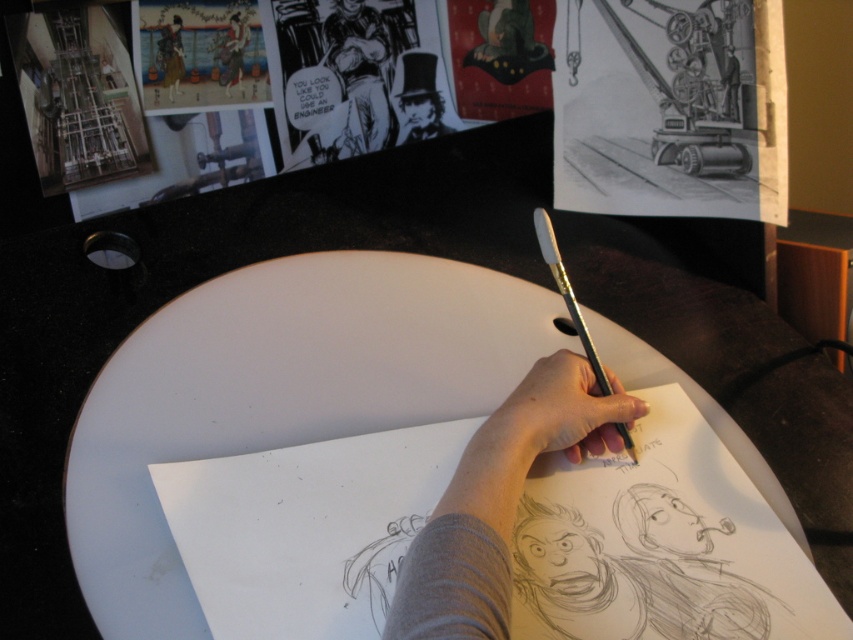
You are an artist trying to place a new character sketch on the workspace table. The point at coordinates [553,417] is located on a hand holding a paintbrush. Is this point on the table or on the artwork being sketched?

The point at coordinates [553,417] is on the smooth skin hand at center, which is holding the paintbrush. Since the hand is part of the artist and not the artwork itself, the point is on the table where the hand is positioned.

You are an artist who needs to place a matte black top hat at upper center and a metallic silver pencil at center on a shelf. The shelf has limited space. Based on their positions in the current scene, which object should you place first to ensure both fit on the shelf?

The matte black top hat at upper center should be placed first since it is positioned to the left of the metallic silver pencil at center in the current scene, indicating it occupies less space on the left side of the shelf.